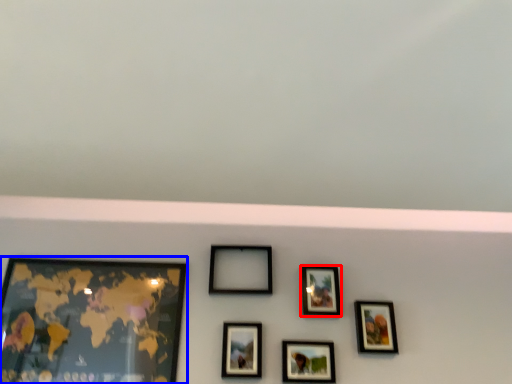
Question: Which point is further to the camera, picture frame (highlighted by a red box) or picture frame (highlighted by a blue box)?

Choices:
 (A) picture frame
 (B) picture frame

Answer: (A)